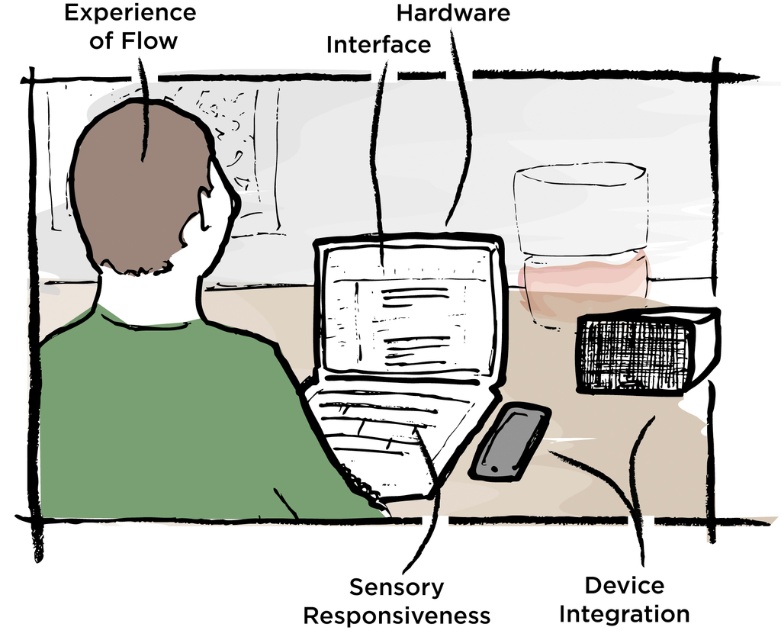
You are trying to place a new keyboard that is exactly the same width as the matte black laptop at center. Will the keyboard fit entirely within the space occupied by the green matte shirt at center?

The matte black laptop at center might be wider than green matte shirt at center, so the keyboard, which is the same width as the laptop, may not fit entirely within the space of the shirt.

You are a delivery robot with a package that needs to be placed on the desk. The package is 3 inches wide. Can you fit the package between the matte black laptop at center and the green matte shirt at center without moving either?

The distance between the matte black laptop at center and the green matte shirt at center is 2.91 inches. Since the package is 3 inches wide, it cannot fit between them without moving either object.